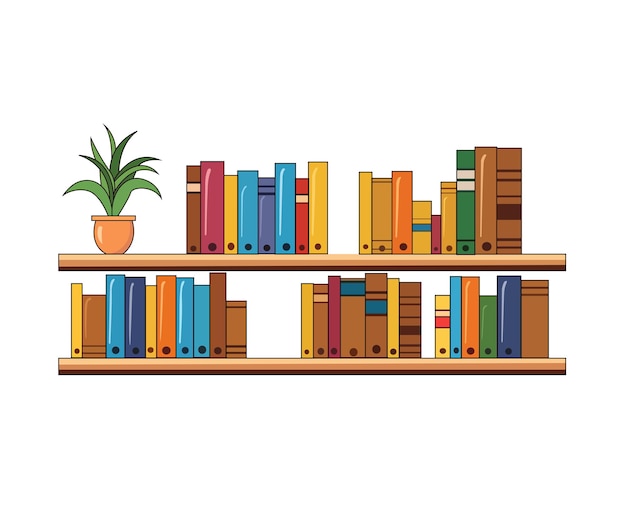
Identify the location of yellow books. Image resolution: width=626 pixels, height=512 pixels. click(x=231, y=201), click(x=74, y=314), click(x=150, y=320), click(x=317, y=210), click(x=364, y=214), click(x=421, y=230), click(x=449, y=214), click(x=439, y=329), click(x=394, y=321), click(x=307, y=328).